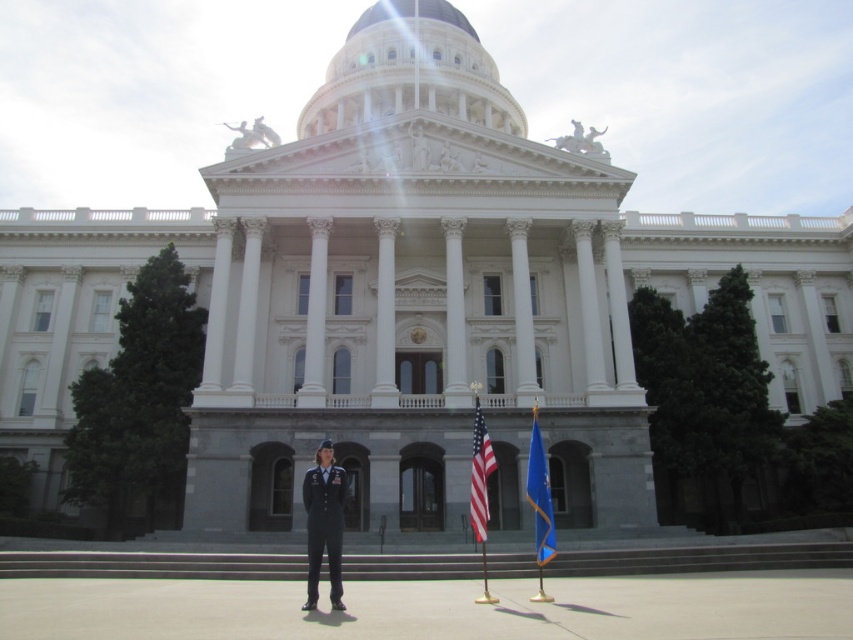
In the scene shown: You are attending a ceremony at the state capitol and notice two flags in front of the building. The blue fabric flag at center and the american flag at center. According to the U.S. flag code, the American flag should never be displayed to the right of another flag when they are displayed together. Is the current arrangement compliant with the flag code?

The blue fabric flag at center is to the right of the american flag at center, which violates the U.S. flag code as the American flag should not be to the left of another flag in such a display.

You are standing in front of the grand neoclassical building and want to determine the relative positions of two points marked in the scene. Which point is closer to you, point 1 at coordinates (x=306, y=548) or point 2 at coordinates (x=477, y=502)?

Point 1 at coordinates (x=306, y=548) is closer to you because it is further to the viewer than point 2 at coordinates (x=477, y=502).

You are a photographer positioned at the front of the building. You want to take a photo that includes both the dark blue uniform at center and the american flag at center. Based on their positions, which object should appear closer to the camera in the photo?

The dark blue uniform at center is in front of the american flag at center, so it will appear closer to the camera in the photo.